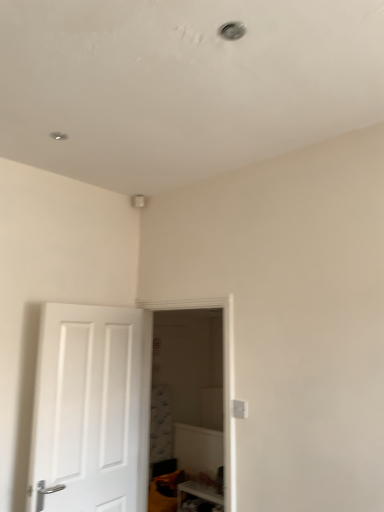
Question: Can you confirm if white glossy shelf at lower right is bigger than transparent glass door at center?

Choices:
 (A) yes
 (B) no

Answer: (B)

Question: From a real-world perspective, is white glossy shelf at lower right positioned under transparent glass door at center based on gravity?

Choices:
 (A) no
 (B) yes

Answer: (B)

Question: Considering the relative positions of white glossy shelf at lower right and transparent glass door at center in the image provided, is white glossy shelf at lower right in front of transparent glass door at center?

Choices:
 (A) yes
 (B) no

Answer: (B)

Question: From the image's perspective, does white glossy shelf at lower right appear lower than transparent glass door at center?

Choices:
 (A) no
 (B) yes

Answer: (B)

Question: Is white glossy shelf at lower right smaller than transparent glass door at center?

Choices:
 (A) no
 (B) yes

Answer: (B)

Question: Is transparent glass door at center at the back of white glossy shelf at lower right?

Choices:
 (A) yes
 (B) no

Answer: (B)

Question: Can you confirm if white matte door at left is smaller than white glossy shelf at lower right?

Choices:
 (A) no
 (B) yes

Answer: (A)

Question: From a real-world perspective, is white matte door at left physically below white glossy shelf at lower right?

Choices:
 (A) no
 (B) yes

Answer: (A)

Question: Is white matte door at left positioned far away from white glossy shelf at lower right?

Choices:
 (A) yes
 (B) no

Answer: (A)

Question: Does white matte door at left come behind white glossy shelf at lower right?

Choices:
 (A) no
 (B) yes

Answer: (A)

Question: Considering the relative positions of white matte door at left and white glossy shelf at lower right in the image provided, is white matte door at left to the right of white glossy shelf at lower right from the viewer's perspective?

Choices:
 (A) yes
 (B) no

Answer: (B)

Question: From a real-world perspective, is white matte door at left located higher than white glossy shelf at lower right?

Choices:
 (A) no
 (B) yes

Answer: (B)

Question: Does white glossy shelf at lower right lie behind white matte door at left?

Choices:
 (A) yes
 (B) no

Answer: (A)